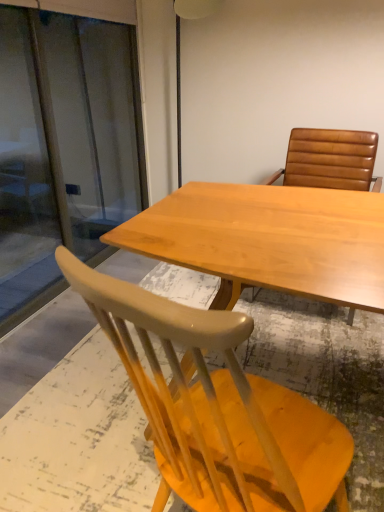
Find the location of a particular element. matte yellow chair at lower left, the 2th chair when ordered from top to bottom is located at coordinates (218, 408).

What do you see at coordinates (218, 408) in the screenshot? The width and height of the screenshot is (384, 512). I see `matte yellow chair at lower left, acting as the first chair starting from the bottom` at bounding box center [218, 408].

The image size is (384, 512). Describe the element at coordinates (330, 160) in the screenshot. I see `brown leather chair at upper right, the second chair from the bottom` at that location.

Image resolution: width=384 pixels, height=512 pixels. I want to click on matte yellow chair at lower left, the 2th chair when ordered from top to bottom, so click(x=218, y=408).

Based on the photo, which of these two, matte yellow chair at lower left, acting as the first chair starting from the bottom, or light wood table at center, is bigger?

With larger size is light wood table at center.

Which of these two, matte yellow chair at lower left, the 2th chair when ordered from top to bottom, or light wood table at center, stands shorter?

With less height is matte yellow chair at lower left, the 2th chair when ordered from top to bottom.

Based on the photo, is matte yellow chair at lower left, the 2th chair when ordered from top to bottom, completely or partially outside of light wood table at center?

matte yellow chair at lower left, the 2th chair when ordered from top to bottom, is positioned outside light wood table at center.

Locate an element on the screen. table that appears above the matte yellow chair at lower left, acting as the first chair starting from the bottom (from a real-world perspective) is located at coordinates (269, 240).

Looking at this image, looking at the image, does brown leather chair at upper right, the second chair from the bottom, seem bigger or smaller compared to transparent glass screen door at left?

In the image, brown leather chair at upper right, the second chair from the bottom, appears to be larger than transparent glass screen door at left.

Does point (342, 165) appear closer or farther from the camera than point (4, 197)?

Clearly, point (342, 165) is closer to the camera than point (4, 197).

Which object is wider, brown leather chair at upper right, the second chair from the bottom, or transparent glass screen door at left?

Wider between the two is brown leather chair at upper right, the second chair from the bottom.

From a real-world perspective, relative to brown leather chair at upper right, the second chair from the bottom, is light wood table at center vertically above or below?

In terms of real-world spatial position, light wood table at center is below brown leather chair at upper right, the second chair from the bottom.

Measure the distance from light wood table at center to brown leather chair at upper right, the second chair from the bottom.

light wood table at center is 36.78 inches away from brown leather chair at upper right, the second chair from the bottom.

Based on their sizes in the image, would you say light wood table at center is bigger or smaller than brown leather chair at upper right, acting as the 1th chair starting from the top?

Clearly, light wood table at center is larger in size than brown leather chair at upper right, acting as the 1th chair starting from the top.

Who is shorter, light wood table at center or brown leather chair at upper right, acting as the 1th chair starting from the top?

light wood table at center.

Does transparent glass screen door at left contain light wood table at center?

No, light wood table at center is located outside of transparent glass screen door at left.

From a real-world perspective, who is located higher, transparent glass screen door at left or light wood table at center?

In real-world perspective, transparent glass screen door at left is above.

Who is bigger, transparent glass screen door at left or light wood table at center?

With larger size is light wood table at center.

Does point (27, 285) appear closer or farther from the camera than point (355, 268)?

Point (27, 285) is farther from the camera than point (355, 268).

Is point (281, 461) farther from camera compared to point (141, 194)?

No, (281, 461) is in front of (141, 194).

Does matte yellow chair at lower left, the 2th chair when ordered from top to bottom, lie in front of transparent glass screen door at left?

Yes.

In the scene shown: From a real-world perspective, is matte yellow chair at lower left, acting as the first chair starting from the bottom, positioned above or below transparent glass screen door at left?

matte yellow chair at lower left, acting as the first chair starting from the bottom, is below transparent glass screen door at left.

Which object is wider, matte yellow chair at lower left, the 2th chair when ordered from top to bottom, or transparent glass screen door at left?

matte yellow chair at lower left, the 2th chair when ordered from top to bottom, is wider.

Between light wood table at center and transparent glass screen door at left, which one has smaller width?

Thinner between the two is transparent glass screen door at left.

Which is more to the right, light wood table at center or transparent glass screen door at left?

light wood table at center.

Based on the photo, can you see light wood table at center touching transparent glass screen door at left?

No, light wood table at center is not beside transparent glass screen door at left.

From the image's perspective, relative to transparent glass screen door at left, is light wood table at center above or below?

light wood table at center is below transparent glass screen door at left.

Can you confirm if light wood table at center is taller than matte yellow chair at lower left, acting as the first chair starting from the bottom?

Correct, light wood table at center is much taller as matte yellow chair at lower left, acting as the first chair starting from the bottom.

Which object is positioned more to the right, light wood table at center or matte yellow chair at lower left, acting as the first chair starting from the bottom?

light wood table at center.

Looking at this image, from the image's perspective, is light wood table at center located beneath matte yellow chair at lower left, acting as the first chair starting from the bottom?

No, from the image's perspective, light wood table at center is not beneath matte yellow chair at lower left, acting as the first chair starting from the bottom.

This screenshot has height=512, width=384. Find the location of `chair below the light wood table at center (from the image's perspective)`. chair below the light wood table at center (from the image's perspective) is located at coordinates (218, 408).

Locate an element on the screen. Image resolution: width=384 pixels, height=512 pixels. the 2nd chair to the right of the transparent glass screen door at left, starting your count from the anchor is located at coordinates (330, 160).

From the picture: Considering their positions, is brown leather chair at upper right, the second chair from the bottom, positioned further to matte yellow chair at lower left, acting as the first chair starting from the bottom, than light wood table at center?

Among the two, brown leather chair at upper right, the second chair from the bottom, is located further to matte yellow chair at lower left, acting as the first chair starting from the bottom.

Looking at the image, which one is located closer to brown leather chair at upper right, the second chair from the bottom, light wood table at center or transparent glass screen door at left?

light wood table at center lies closer to brown leather chair at upper right, the second chair from the bottom, than the other object.

Considering their positions, is light wood table at center positioned closer to transparent glass screen door at left than matte yellow chair at lower left, acting as the first chair starting from the bottom?

Among the two, light wood table at center is located nearer to transparent glass screen door at left.

Which object lies further to the anchor point matte yellow chair at lower left, the 2th chair when ordered from top to bottom, brown leather chair at upper right, acting as the 1th chair starting from the top, or transparent glass screen door at left?

Among the two, transparent glass screen door at left is located further to matte yellow chair at lower left, the 2th chair when ordered from top to bottom.

Estimate the real-world distances between objects in this image. Which object is further from matte yellow chair at lower left, the 2th chair when ordered from top to bottom, light wood table at center or transparent glass screen door at left?

The object further to matte yellow chair at lower left, the 2th chair when ordered from top to bottom, is transparent glass screen door at left.

From the image, which object appears to be nearer to brown leather chair at upper right, acting as the 1th chair starting from the top, transparent glass screen door at left or matte yellow chair at lower left, the 2th chair when ordered from top to bottom?

matte yellow chair at lower left, the 2th chair when ordered from top to bottom, lies closer to brown leather chair at upper right, acting as the 1th chair starting from the top, than the other object.

Looking at the image, which one is located further to transparent glass screen door at left, brown leather chair at upper right, acting as the 1th chair starting from the top, or matte yellow chair at lower left, acting as the first chair starting from the bottom?

Based on the image, matte yellow chair at lower left, acting as the first chair starting from the bottom, appears to be further to transparent glass screen door at left.

Considering their positions, is matte yellow chair at lower left, acting as the first chair starting from the bottom, positioned further to light wood table at center than brown leather chair at upper right, the second chair from the bottom?

brown leather chair at upper right, the second chair from the bottom, is positioned further to the anchor light wood table at center.

Where is `chair between light wood table at center and brown leather chair at upper right, acting as the 1th chair starting from the top, in the front-back direction`? This screenshot has height=512, width=384. chair between light wood table at center and brown leather chair at upper right, acting as the 1th chair starting from the top, in the front-back direction is located at coordinates (218, 408).

Where is `table that lies between transparent glass screen door at left and matte yellow chair at lower left, the 2th chair when ordered from top to bottom, from top to bottom`? table that lies between transparent glass screen door at left and matte yellow chair at lower left, the 2th chair when ordered from top to bottom, from top to bottom is located at coordinates (269, 240).

Identify the location of chair situated between transparent glass screen door at left and brown leather chair at upper right, the second chair from the bottom, from left to right. Image resolution: width=384 pixels, height=512 pixels. (218, 408).

Locate an element on the screen. table situated between transparent glass screen door at left and brown leather chair at upper right, acting as the 1th chair starting from the top, from left to right is located at coordinates (269, 240).